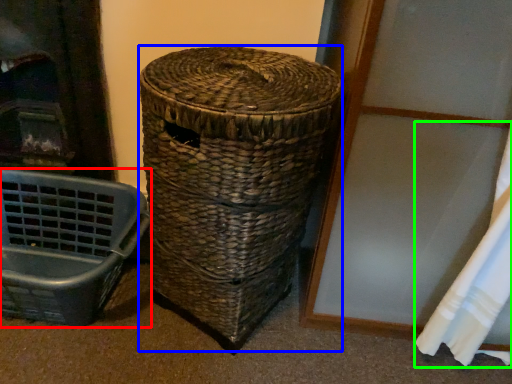
Question: Which object is positioned closest to furniture (highlighted by a red box)? Select from basket (highlighted by a blue box) and curtain (highlighted by a green box).

Choices:
 (A) basket
 (B) curtain

Answer: (A)